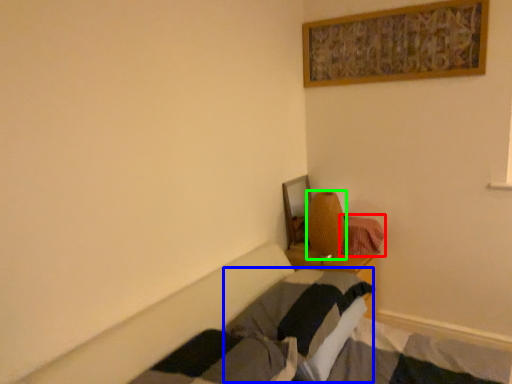
Question: Considering the real-world distances, which object is closest to blanket (highlighted by a red box)? pillow (highlighted by a blue box) or lamp (highlighted by a green box).

Choices:
 (A) pillow
 (B) lamp

Answer: (B)